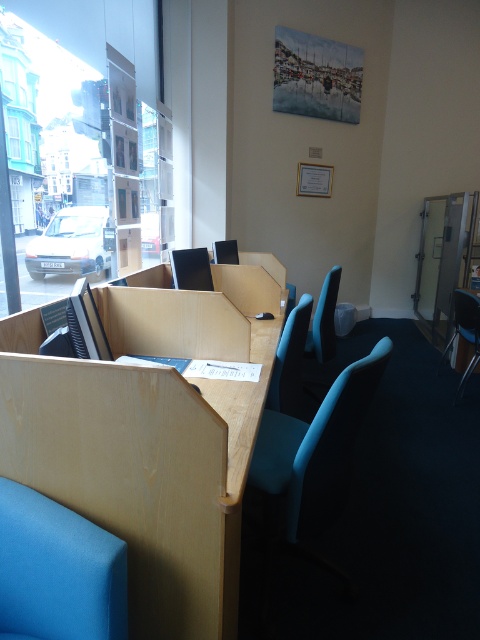
You are standing in the study area and want to sit down at the chair located at point (316, 449). Can you confirm the color of the chair at that specific coordinate?

The chair at point (316, 449) is matte blue.

You are standing in the study area and want to move from the point at coordinates point (332, 332) to the point at coordinates point (113, 259). Can you walk directly between them without any obstacles?

Point point (332, 332) is behind point point (113, 259), so you cannot walk directly between them without passing through the latter point first.

You are standing in the study area and want to move from point A to point B. Point A is at coordinate point A which is point (49,524) and point B is at point (300,356). Which point is closer to you when you are facing the direction of the street view through the large windows?

Point A at point (49,524) is closer to you because it is in front of point B at point (300,356) when facing the street view through the large windows.